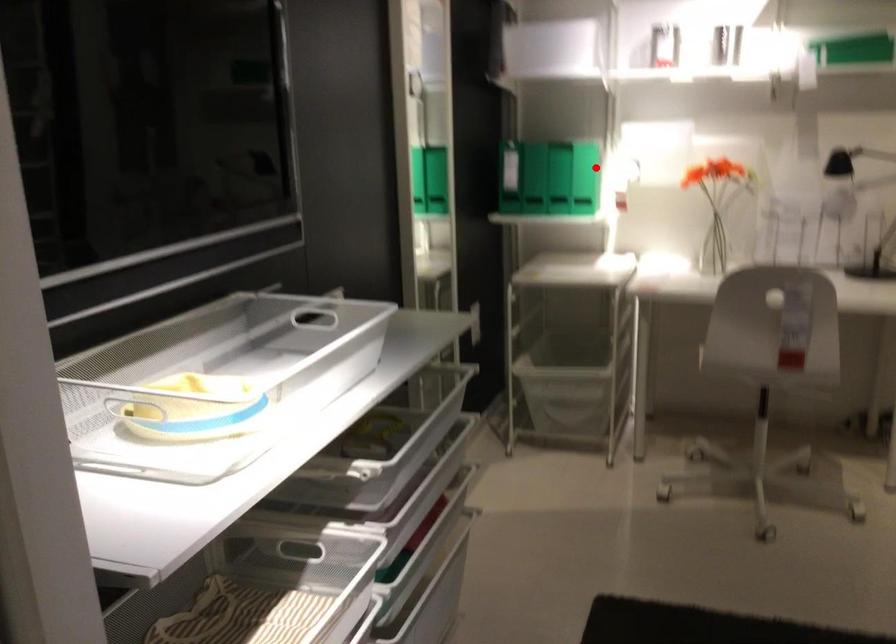
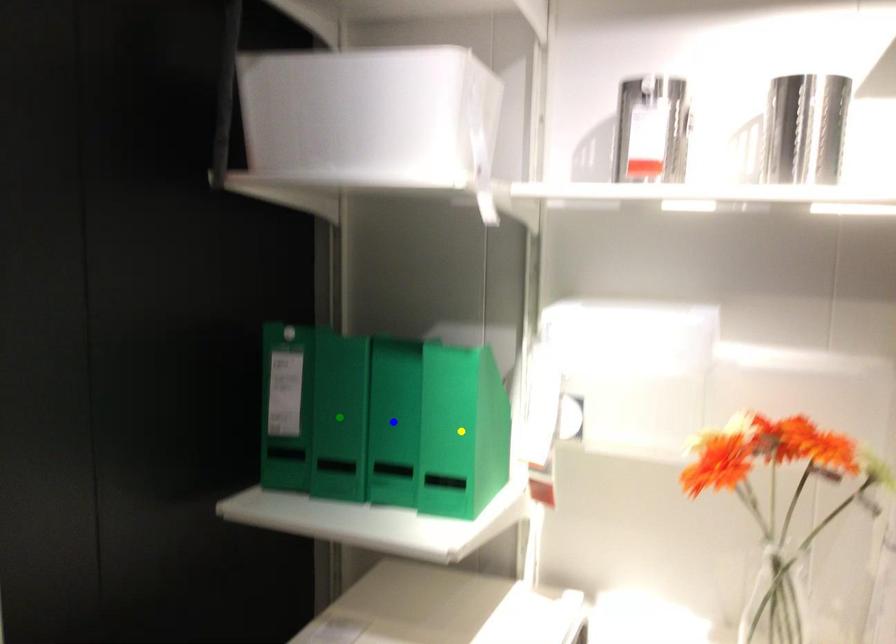
Question: I am providing you with two images of the same scene from different viewpoints. A red point is marked on the first image. You are given multiple points on the second image. Which mark in image 2 goes with the point in image 1?

Choices:
 (A) blue point
 (B) yellow point
 (C) green point

Answer: (B)